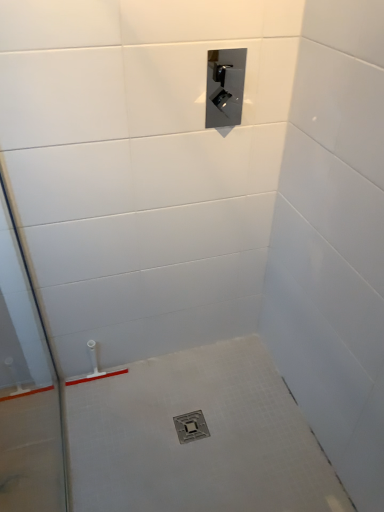
Image resolution: width=384 pixels, height=512 pixels. Describe the element at coordinates (26, 387) in the screenshot. I see `transparent glass door at left` at that location.

Measure the distance between point (210, 121) and camera.

Point (210, 121) and camera are 1.88 meters apart from each other.

At what (x,y) coordinates should I click in order to perform the action: click on metallic silver drain at center. Please return your answer as a coordinate pair (x, y). The image size is (384, 512). Looking at the image, I should click on (191, 426).

Between metallic silver drain at center and transparent glass door at left, which one has smaller width?

Thinner between the two is transparent glass door at left.

Which of these two, metallic silver drain at center or transparent glass door at left, is smaller?

Smaller between the two is metallic silver drain at center.

Would you consider metallic silver drain at center to be distant from transparent glass door at left?

No, metallic silver drain at center is not far from transparent glass door at left.

Based on the photo, is metallic silver drain at center aimed at transparent glass door at left?

No.

Does point (7, 388) appear closer or farther from the camera than point (226, 83)?

Clearly, point (7, 388) is more distant from the camera than point (226, 83).

From the picture: Is transparent glass door at left further to the viewer compared to satin nickel control panel at upper center?

No, transparent glass door at left is closer to the viewer.

Is transparent glass door at left situated inside satin nickel control panel at upper center or outside?

transparent glass door at left is not enclosed by satin nickel control panel at upper center.

Is transparent glass door at left next to satin nickel control panel at upper center and touching it?

No, transparent glass door at left is not in contact with satin nickel control panel at upper center.

Can you confirm if satin nickel control panel at upper center is shorter than transparent glass door at left?

Indeed, satin nickel control panel at upper center has a lesser height compared to transparent glass door at left.

From a real-world perspective, who is located higher, satin nickel control panel at upper center or transparent glass door at left?

satin nickel control panel at upper center.

Is satin nickel control panel at upper center behind transparent glass door at left?

Yes, the depth of satin nickel control panel at upper center is greater than that of transparent glass door at left.

In terms of width, does satin nickel control panel at upper center look wider or thinner when compared to transparent glass door at left?

Clearly, satin nickel control panel at upper center has less width compared to transparent glass door at left.

Could metallic silver drain at center be considered to be inside transparent glass door at left?

Definitely not — metallic silver drain at center is not inside transparent glass door at left.

From the image's perspective, which is above, transparent glass door at left or metallic silver drain at center?

transparent glass door at left, from the image's perspective.

From a real-world perspective, which is physically below, transparent glass door at left or metallic silver drain at center?

In real-world perspective, metallic silver drain at center is lower.

Considering the sizes of objects transparent glass door at left and metallic silver drain at center in the image provided, who is shorter, transparent glass door at left or metallic silver drain at center?

metallic silver drain at center is shorter.

In the scene shown: Which of these two, satin nickel control panel at upper center or metallic silver drain at center, is smaller?

metallic silver drain at center.

From a real-world perspective, is satin nickel control panel at upper center located beneath metallic silver drain at center?

No, from a real-world perspective, satin nickel control panel at upper center is not under metallic silver drain at center.

Does satin nickel control panel at upper center turn towards metallic silver drain at center?

No, satin nickel control panel at upper center is not oriented towards metallic silver drain at center.

From the image's perspective, relative to metallic silver drain at center, is satin nickel control panel at upper center above or below?

satin nickel control panel at upper center is situated higher than metallic silver drain at center in the image.

Would you say metallic silver drain at center contains satin nickel control panel at upper center?

No, satin nickel control panel at upper center is not a part of metallic silver drain at center.

Between metallic silver drain at center and satin nickel control panel at upper center, which one has larger width?

With larger width is metallic silver drain at center.

In the scene shown: Does metallic silver drain at center appear on the right side of satin nickel control panel at upper center?

No, metallic silver drain at center is not to the right of satin nickel control panel at upper center.

Is satin nickel control panel at upper center at the back of metallic silver drain at center?

metallic silver drain at center is not turned away from satin nickel control panel at upper center.

This screenshot has height=512, width=384. I want to click on glass door on the left of metallic silver drain at center, so click(26, 387).

The width and height of the screenshot is (384, 512). What are the coordinates of `plumbing fixture lying on the right of transparent glass door at left` in the screenshot? It's located at (225, 87).

Considering their positions, is satin nickel control panel at upper center positioned closer to transparent glass door at left than metallic silver drain at center?

metallic silver drain at center is positioned closer to the anchor transparent glass door at left.

When comparing their distances from satin nickel control panel at upper center, does metallic silver drain at center or transparent glass door at left seem closer?

Among the two, transparent glass door at left is located nearer to satin nickel control panel at upper center.

Looking at the image, which one is located closer to metallic silver drain at center, transparent glass door at left or satin nickel control panel at upper center?

Among the two, transparent glass door at left is located nearer to metallic silver drain at center.

Which object lies further to the anchor point satin nickel control panel at upper center, transparent glass door at left or metallic silver drain at center?

metallic silver drain at center lies further to satin nickel control panel at upper center than the other object.

Looking at the image, which one is located further to transparent glass door at left, metallic silver drain at center or satin nickel control panel at upper center?

satin nickel control panel at upper center.

Considering their positions, is satin nickel control panel at upper center positioned closer to metallic silver drain at center than transparent glass door at left?

Answer: transparent glass door at left is positioned closer to the anchor metallic silver drain at center.

Find the location of a particular element. The height and width of the screenshot is (512, 384). glass door between satin nickel control panel at upper center and metallic silver drain at center in the vertical direction is located at coordinates (26, 387).